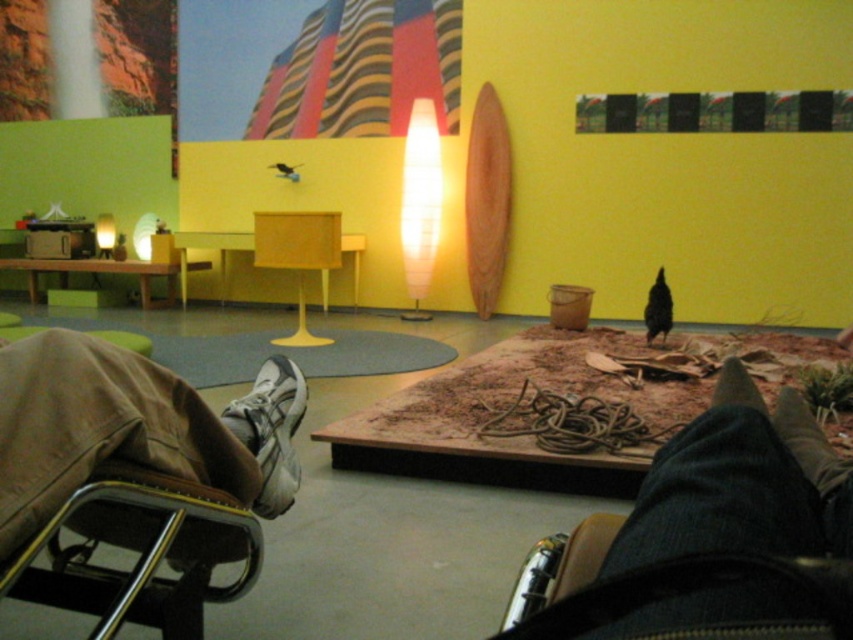
Question: Which point is farther from the camera taking this photo?

Choices:
 (A) (229, 403)
 (B) (233, 525)

Answer: (A)

Question: Among these points, which one is nearest to the camera?

Choices:
 (A) (57, 376)
 (B) (262, 416)

Answer: (A)

Question: Is metallic silver folding chair at lower left to the left of white mesh shoe at lower left from the viewer's perspective?

Choices:
 (A) no
 (B) yes

Answer: (B)

Question: Considering the relative positions of metallic silver folding chair at lower left and white mesh shoe at lower left in the image provided, where is metallic silver folding chair at lower left located with respect to white mesh shoe at lower left?

Choices:
 (A) right
 (B) left

Answer: (B)

Question: Can you confirm if metallic silver folding chair at lower left is wider than white mesh shoe at lower left?

Choices:
 (A) no
 (B) yes

Answer: (B)